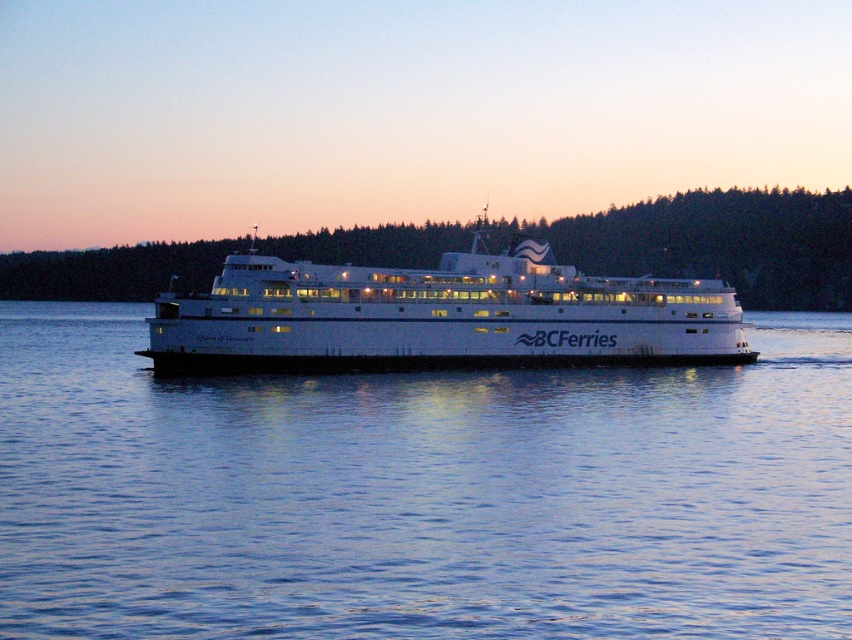
You are standing on the ferry and looking towards the point at coordinates point (421, 493). What is the color of the surface you are looking at?

The point (421, 493) is on blue water at center, so the surface is blue.